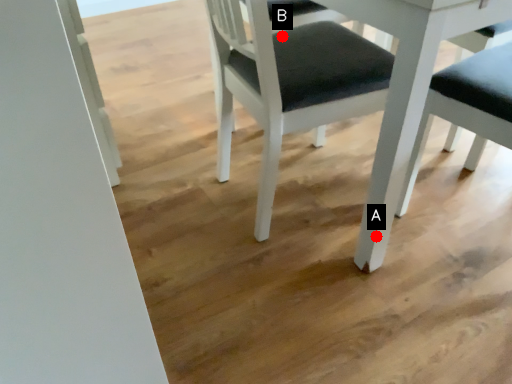
Question: Two points are circled on the image, labeled by A and B beside each circle. Among these points, which one is farthest from the camera?

Choices:
 (A) A is further
 (B) B is further

Answer: (B)